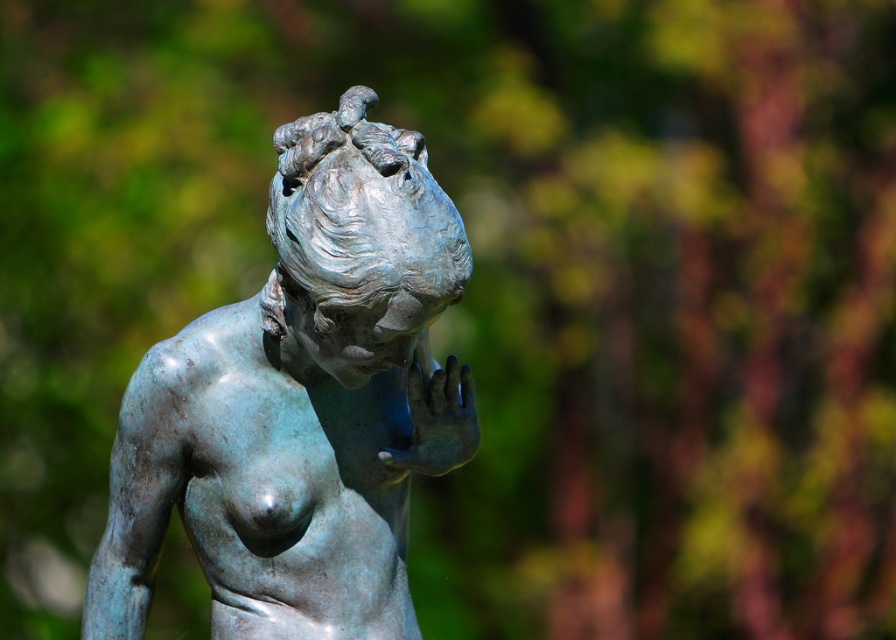
Locate an element on the screen. blue-green patina statue at center is located at coordinates (300, 403).

Does blue-green patina statue at center lie behind blue patina hand at center?

No, it is in front of blue patina hand at center.

Does point (152, 497) come behind point (418, 392)?

No, it is in front of (418, 392).

You are a GUI agent. You are given a task and a screenshot of the screen. Output one action in this format:
    pyautogui.click(x=<x>, y=<y>)
    Task: Click on the blue-green patina statue at center
    
    Given the screenshot: What is the action you would take?
    pyautogui.click(x=300, y=403)